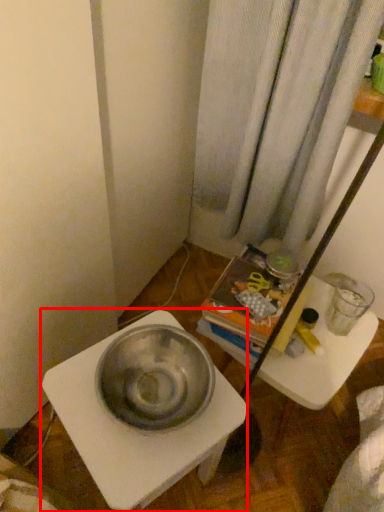
Question: Considering the relative positions of table (annotated by the red box) and vanity in the image provided, where is table (annotated by the red box) located with respect to the staircase?

Choices:
 (A) right
 (B) left

Answer: (B)